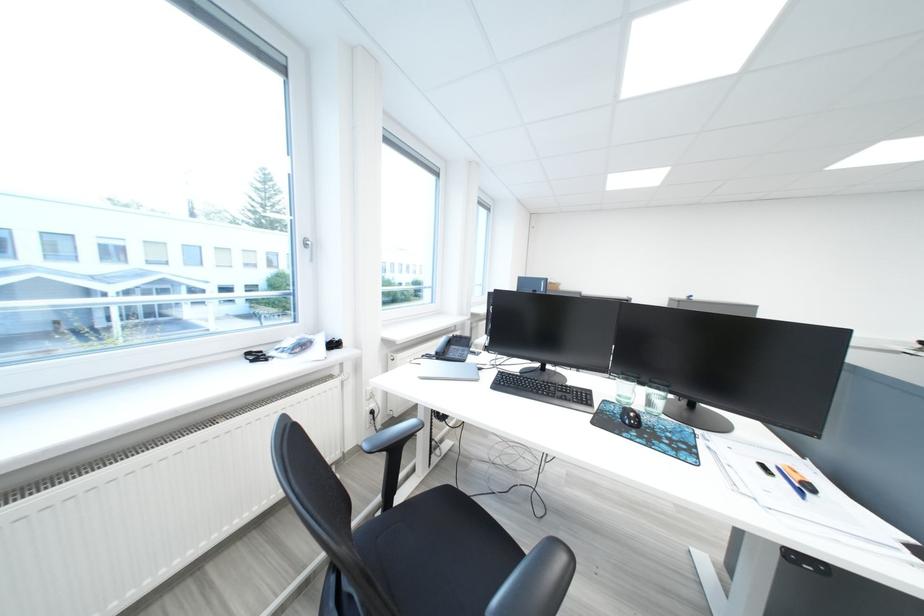
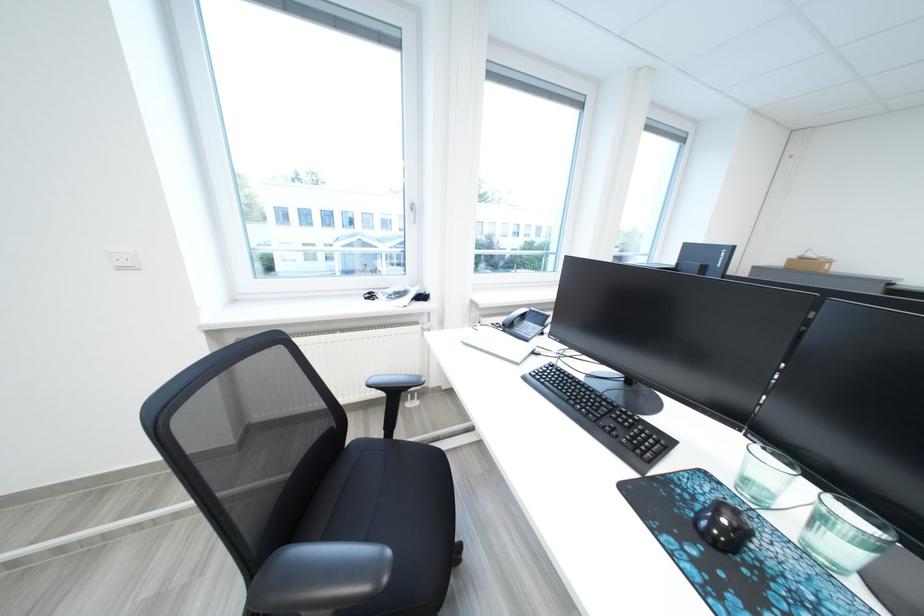
Question: The camera is either moving clockwise (left) or counter-clockwise (right) around the object. The first image is from the beginning of the video and the second image is from the end. Is the camera moving left or right when shooting the video?

Choices:
 (A) Left
 (B) Right

Answer: (B)